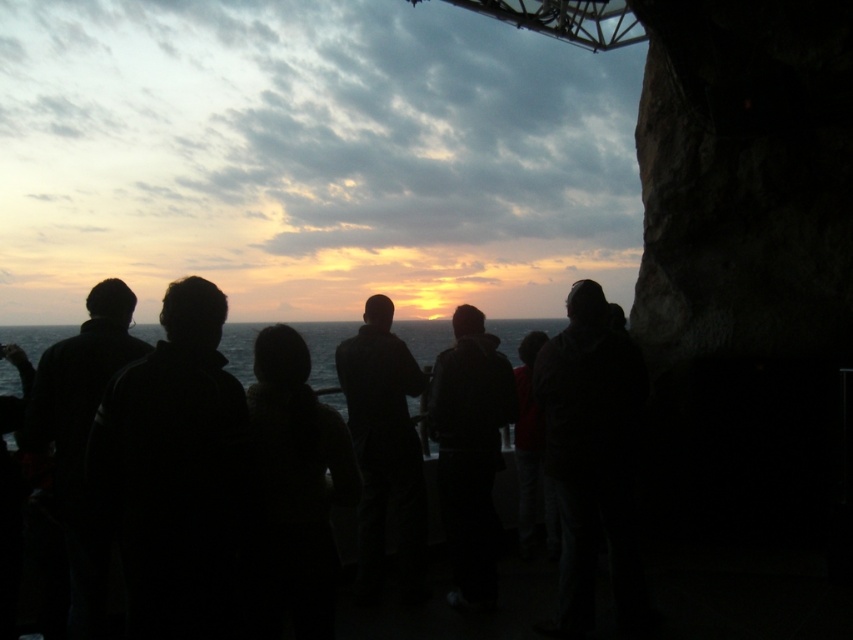
You are a photographer trying to capture the sunset scene. You notice two points in the image at coordinates point (328, 346) and point (318, 385). Based on their positions, which point is closer to the camera?

Point (318, 385) is closer to the camera because it is in front of point (328, 346).

You are a photographer trying to capture the sunset scene. You want to place the group of black matte people at center in the lower third of the frame. Are they currently positioned there?

The black matte people at center are located at point 0.677 on the x axis and 0.103 on the y axis. Since the lower third of the frame typically occupies the bottom portion of the image, their y coordinate of 0.103 places them within that area. Yes, they are positioned in the lower third of the frame.

You are a photographer trying to capture the sunset scene. You notice the black matte people at center and the olive green water at center. Which object should you adjust your camera focus to first if you want to ensure the people are in front of the water?

The black matte people at center is positioned on the right side of olive green water at center, so you should focus on the black matte people at center first since they are in front of the water.